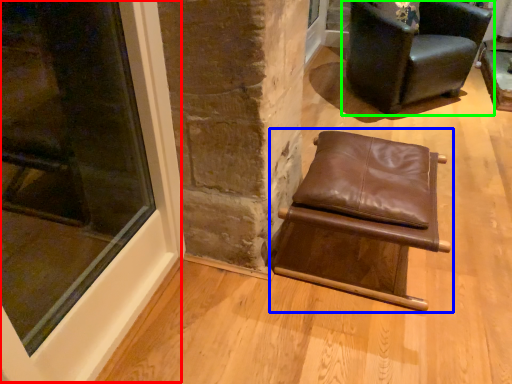
Question: Which is farther away from window (highlighted by a red box)? chair (highlighted by a blue box) or chair (highlighted by a green box)?

Choices:
 (A) chair
 (B) chair

Answer: (B)